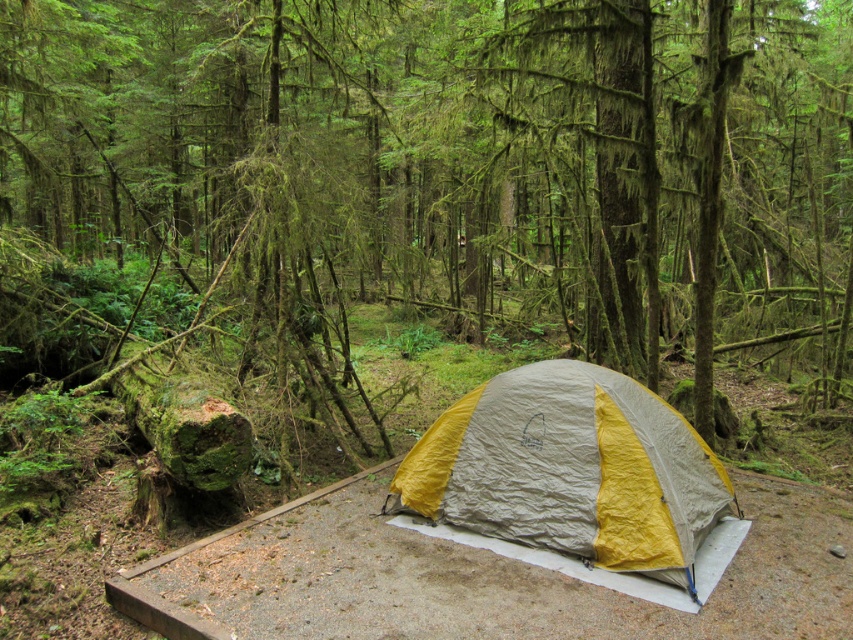
Question: Which point is closer to the camera?

Choices:
 (A) green mossy tree at center
 (B) yellow fabric tent at center

Answer: (B)

Question: Does green mossy tree at center appear on the left side of yellow fabric tent at center?

Choices:
 (A) no
 (B) yes

Answer: (B)

Question: Can you confirm if green mossy tree at center is wider than yellow fabric tent at center?

Choices:
 (A) yes
 (B) no

Answer: (A)

Question: Which point is closer to the camera taking this photo?

Choices:
 (A) (541, 426)
 (B) (212, 253)

Answer: (A)

Question: Is green mossy tree at center thinner than yellow fabric tent at center?

Choices:
 (A) yes
 (B) no

Answer: (B)

Question: Which point is farther to the camera?

Choices:
 (A) green mossy tree at center
 (B) yellow fabric tent at center

Answer: (A)